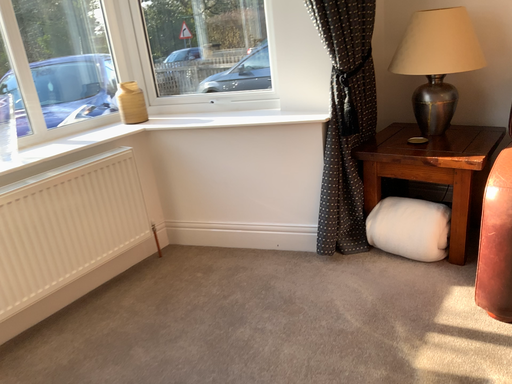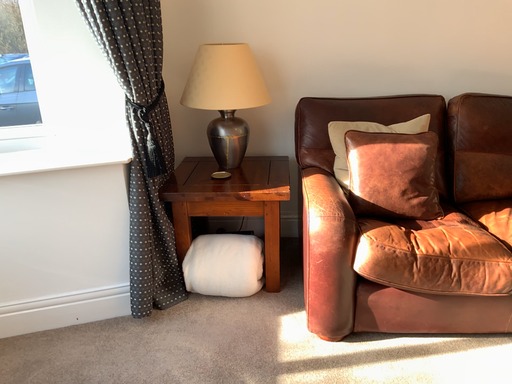
Question: Which way did the camera rotate in the video?

Choices:
 (A) rotated upward
 (B) rotated downward

Answer: (A)